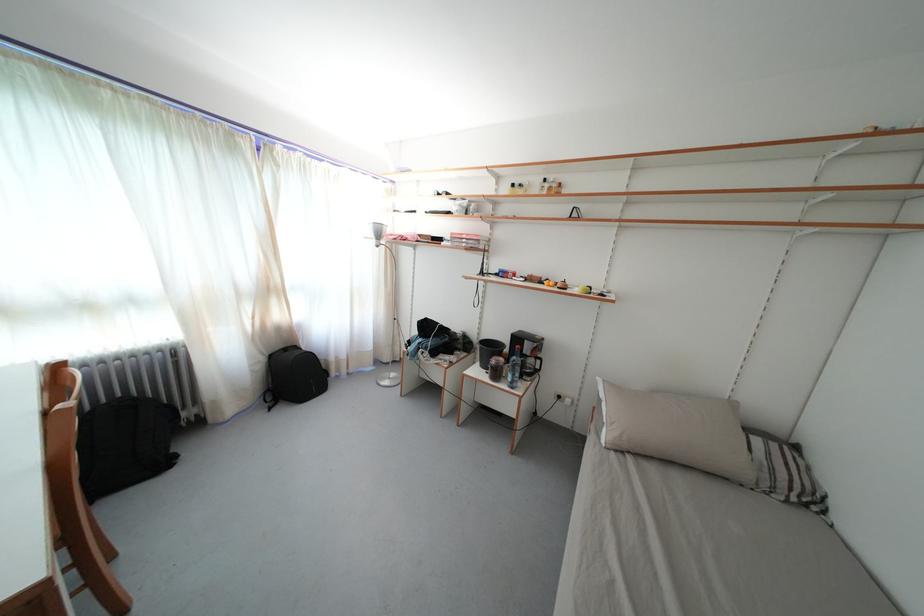
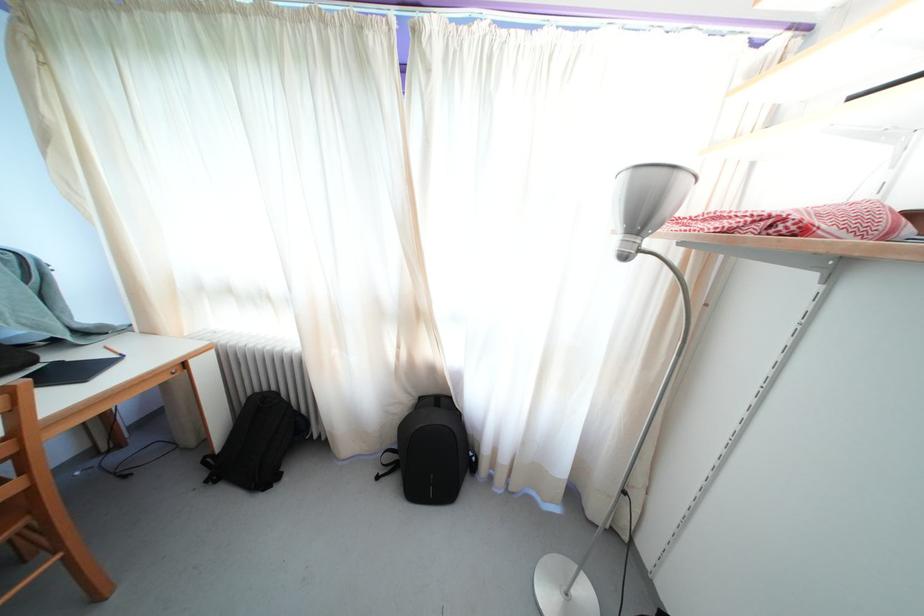
Locate, in the second image, the point that corresponds to (384,241) in the first image.

(648, 223)